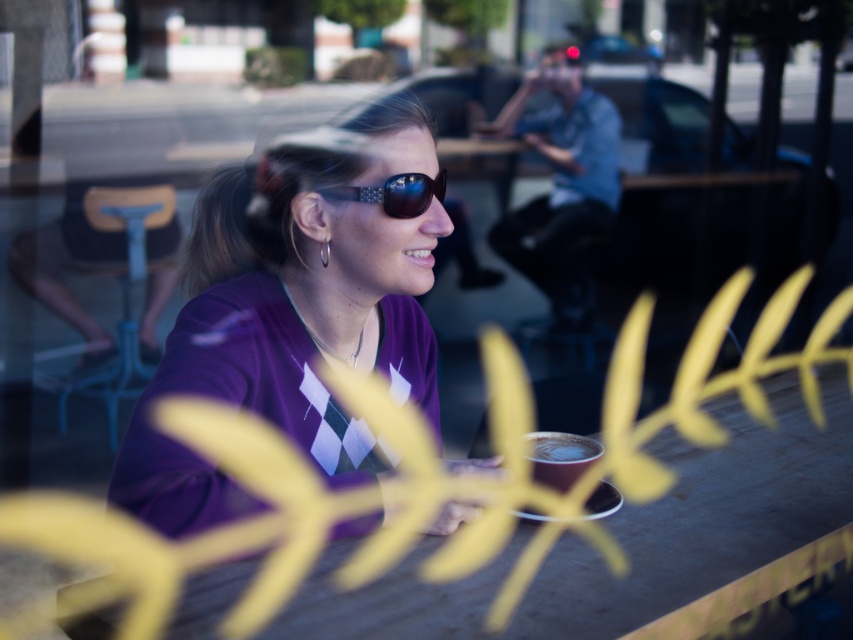
You are trying to place a small decorative item on the smooth wooden table at center. The item is exactly the same width as the shiny black sunglasses at center. Will the item fit on the table?

The smooth wooden table at center might be wider than shiny black sunglasses at center, so the item should fit since the table is likely wider than the sunglasses.

You are standing at the center of the image and want to take a photo. There are two points marked in the scene, point (306, 196) and point (410, 179). Which point is closer to your camera lens?

Point (306, 196) is further to the camera than point (410, 179), so the point closer to the camera lens is point (410, 179).

You are a waiter at the cafe and need to place a dessert plate on the table. The plate is the same size as the shiny black sunglasses at center. Will the dessert plate fit on the smooth wooden table at center?

The smooth wooden table at center has a larger size compared to shiny black sunglasses at center, so the dessert plate, which is the same size as the sunglasses, will fit on the table.